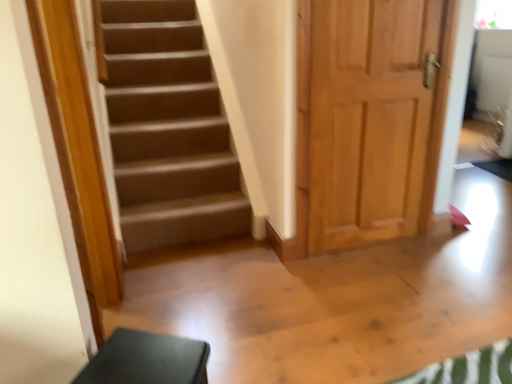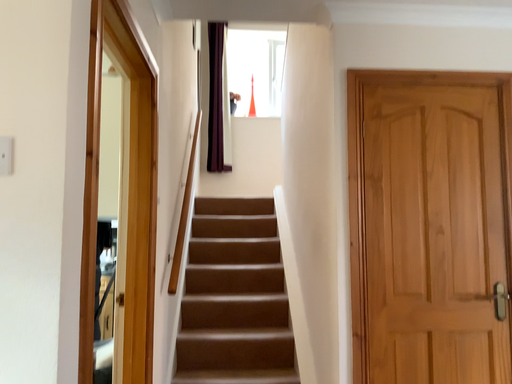
Question: How did the camera likely rotate when shooting the video?

Choices:
 (A) rotated left
 (B) rotated right

Answer: (A)